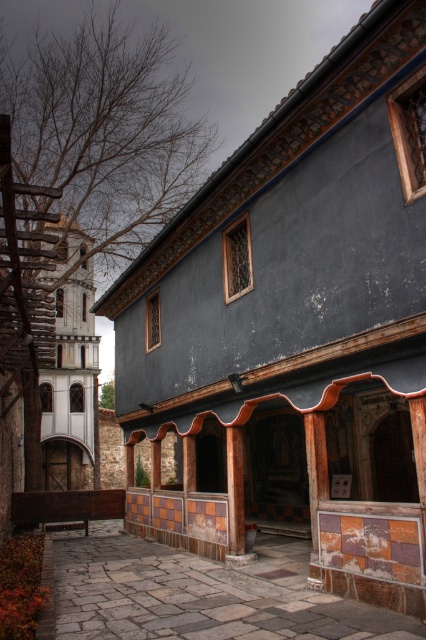
Question: Can you confirm if rustic stone courtyard at center is bigger than brown wood pillar at center?

Choices:
 (A) yes
 (B) no

Answer: (A)

Question: Is rustic stone courtyard at center smaller than brown wood pillar at center?

Choices:
 (A) no
 (B) yes

Answer: (A)

Question: Does rustic stone courtyard at center appear under brown wood pillar at center?

Choices:
 (A) yes
 (B) no

Answer: (A)

Question: Among these points, which one is farthest from the camera?

Choices:
 (A) (242, 480)
 (B) (207, 634)

Answer: (A)

Question: Which object appears farthest from the camera in this image?

Choices:
 (A) rustic stone courtyard at center
 (B) brown wood pillar at center

Answer: (B)